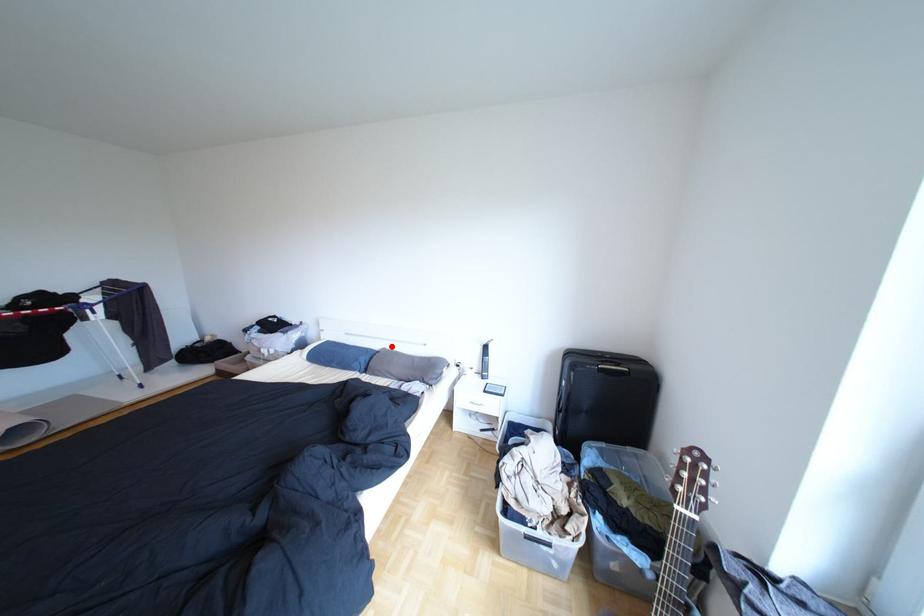
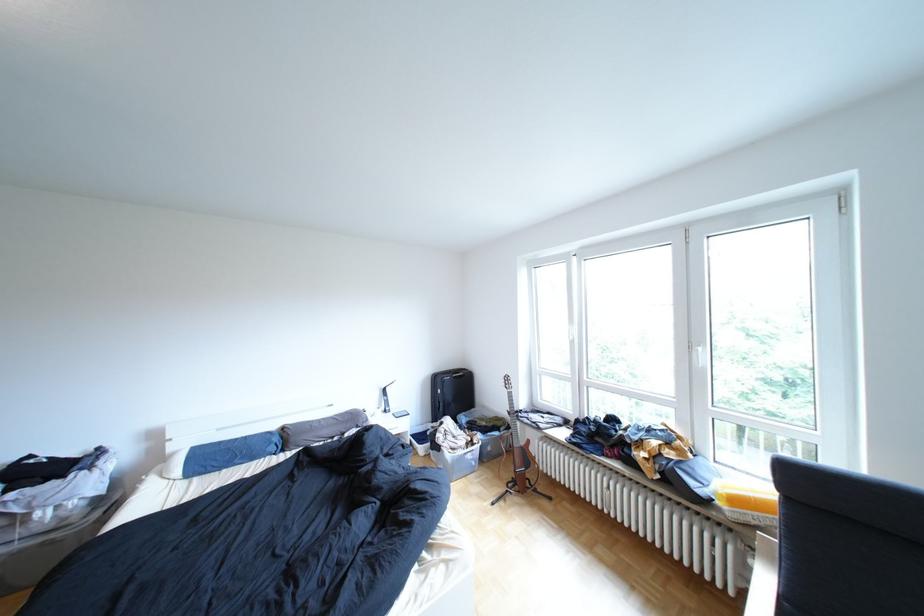
In the second image, find the point that corresponds to the highlighted location in the first image.

(289, 427)